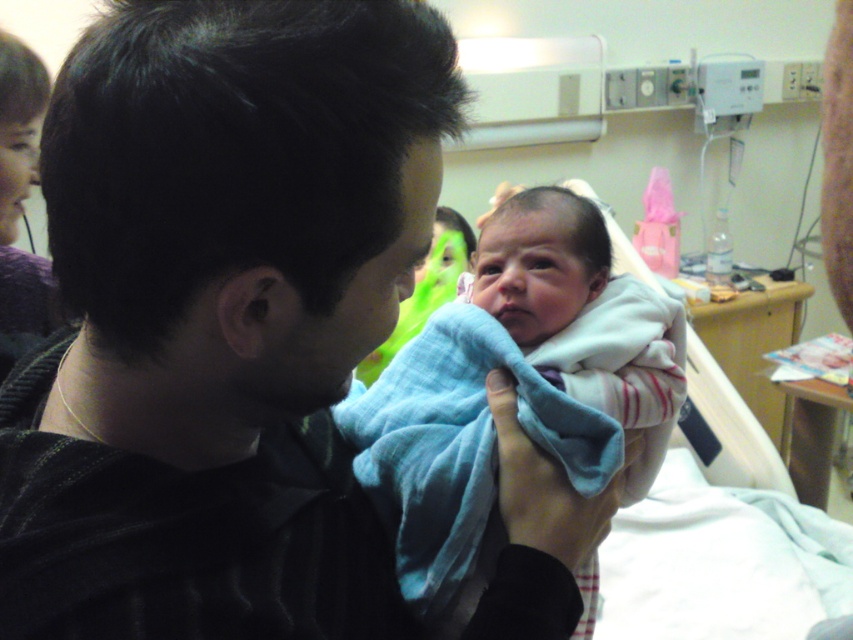
You are a nurse in a hospital room and need to reach the black sweater at center to give it to the patient. Can you comfortably reach it without moving your position?

The black sweater at center is 16.17 inches away from the viewer, so yes, the nurse can comfortably reach it without moving their position.

You are a nurse in the hospital room and need to determine which item is shorter between the black sweater at center and the soft blue blanket at center. Which one is shorter?

The black sweater at center is shorter than the soft blue blanket at center.